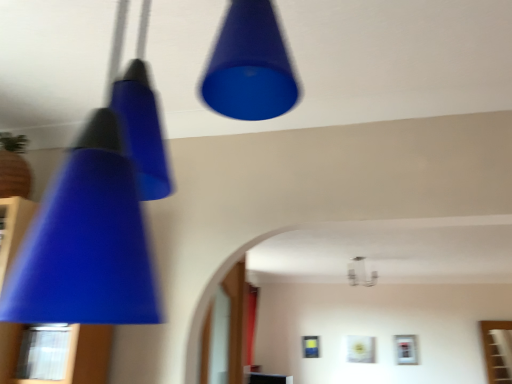
The height and width of the screenshot is (384, 512). I want to click on metallic silver lamp at center, so click(361, 273).

Image resolution: width=512 pixels, height=384 pixels. Describe the element at coordinates (361, 273) in the screenshot. I see `metallic silver lamp at center` at that location.

Find the location of `metallic silver lamp at center`. metallic silver lamp at center is located at coordinates (361, 273).